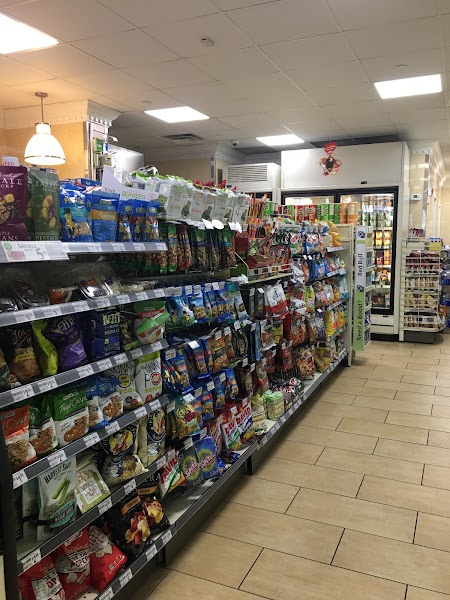
At what (x,y) coordinates should I click in order to perform the action: click on air vent. Please return your answer as a coordinate pair (x, y). Looking at the image, I should click on (246, 171).